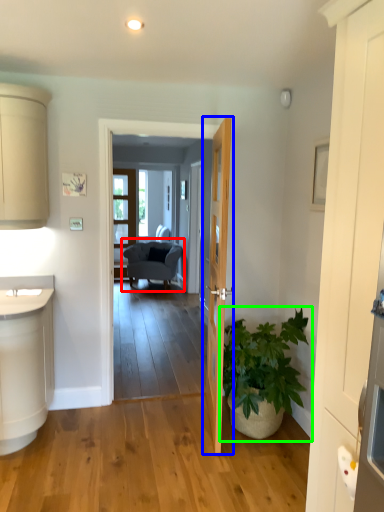
Question: Based on their relative distances, which object is farther from chair (highlighted by a red box)? Choose from door (highlighted by a blue box) and houseplant (highlighted by a green box).

Choices:
 (A) door
 (B) houseplant

Answer: (A)